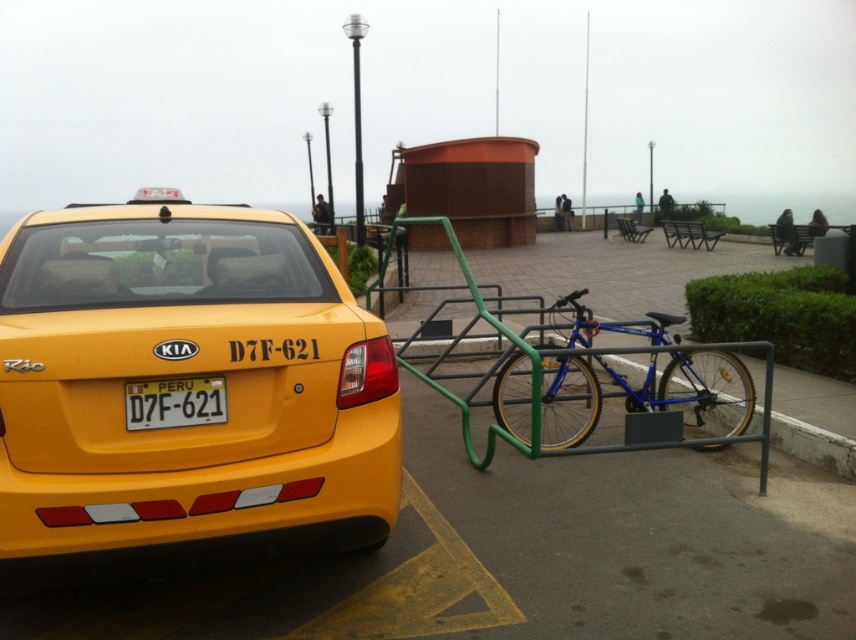
You are a delivery person who needs to park your bike next to the green metal bike rack at center. However, there is a yellow plastic license plate at rear nearby. Which object should you place your bike next to, and why?

You should place your bike next to the green metal bike rack at center because it is designed for securing bikes, whereas the yellow plastic license plate at rear is part of the taxi and not meant for bike parking.

You are standing on the promenade and want to take a photo of both the yellow matte taxi at upper left and the blue metallic bicycle at center. Which object should you focus on first to ensure both are in the frame?

You should focus on the yellow matte taxi at upper left first since it is closer to you than the blue metallic bicycle at center, ensuring both are in the frame by adjusting the camera angle accordingly.

You are a delivery person needing to park your 2.5 meter wide delivery van between the yellow matte taxi at upper left and the green metal bike rack at center. Can you fit your van in the space between them?

The yellow matte taxi at upper left has a lesser width compared to green metal bike rack at center. However, the total available space between them isn not specified. Without knowing the distance between the two objects, it is impossible to determine if the 2.5 meter wide van can fit.